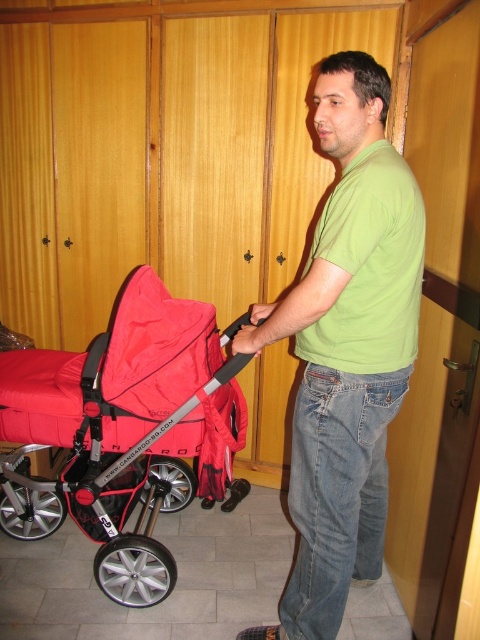
The height and width of the screenshot is (640, 480). What do you see at coordinates (346, 348) in the screenshot? I see `green matte shirt at center` at bounding box center [346, 348].

Is point (332, 292) positioned in front of point (15, 512)?

That is True.

Identify the location of green matte shirt at center. This screenshot has height=640, width=480. (346, 348).

Identify the location of green matte shirt at center. Image resolution: width=480 pixels, height=640 pixels. (346, 348).